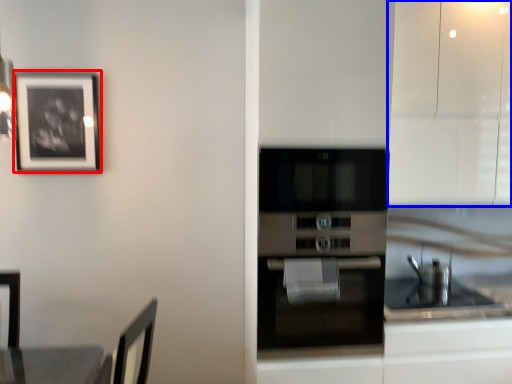
Question: Among these objects, which one is farthest to the camera, picture frame (highlighted by a red box) or cabinetry (highlighted by a blue box)?

Choices:
 (A) picture frame
 (B) cabinetry

Answer: (A)